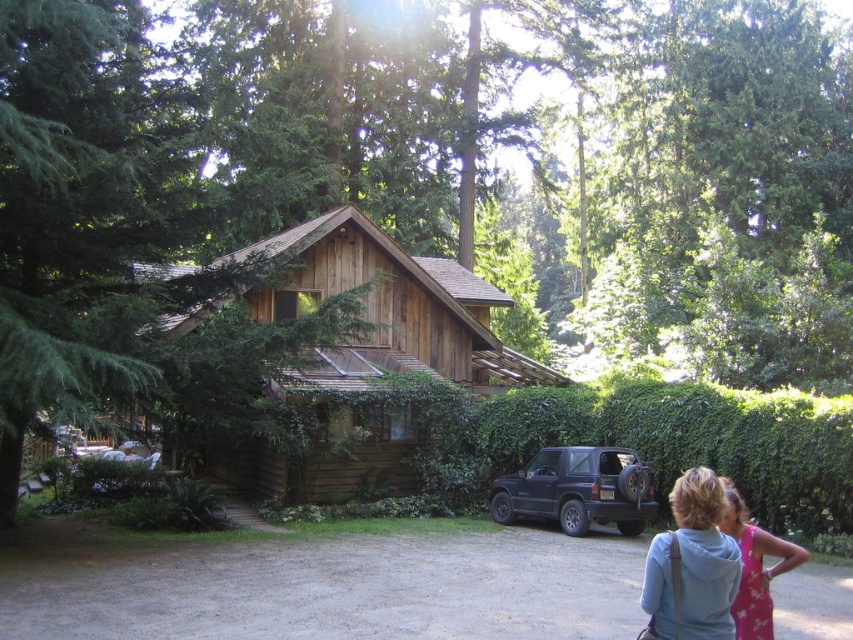
Which is in front, point (799, 573) or point (608, 403)?

Point (799, 573) is more forward.

Who is more forward, (218, 548) or (846, 442)?

Positioned in front is point (218, 548).

Where is `dirt/gravel driveway at lower center`? Image resolution: width=853 pixels, height=640 pixels. dirt/gravel driveway at lower center is located at coordinates (323, 584).

What do you see at coordinates (363, 355) in the screenshot?
I see `wooden cabin at center` at bounding box center [363, 355].

Between wooden cabin at center and pink fabric at lower right, which one has more height?

Standing taller between the two is wooden cabin at center.

Is point (357, 397) behind point (701, 572)?

That is True.

The width and height of the screenshot is (853, 640). Identify the location of wooden cabin at center. (363, 355).

Does dirt/gravel driveway at lower center have a smaller size compared to wooden cabin at center?

Yes.

Which is in front, point (347, 634) or point (363, 432)?

Positioned in front is point (347, 634).

Is point (512, 532) closer to camera compared to point (397, 429)?

Yes, it is in front of point (397, 429).

This screenshot has width=853, height=640. Find the location of `dirt/gravel driveway at lower center`. dirt/gravel driveway at lower center is located at coordinates click(323, 584).